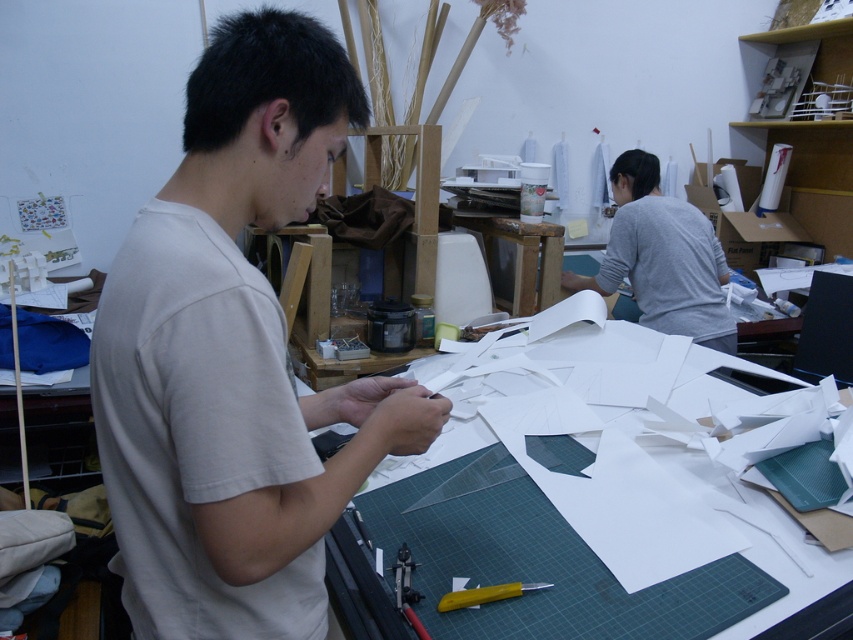
Is white matte shirt at center positioned in front of white paper at center?

Yes, white matte shirt at center is closer to the viewer.

Is point (265, 472) positioned behind point (538, 624)?

No, (265, 472) is closer to viewer.

Is point (196, 467) in front of point (566, 428)?

Yes, it is.

Where is `white matte shirt at center`? This screenshot has width=853, height=640. white matte shirt at center is located at coordinates (234, 356).